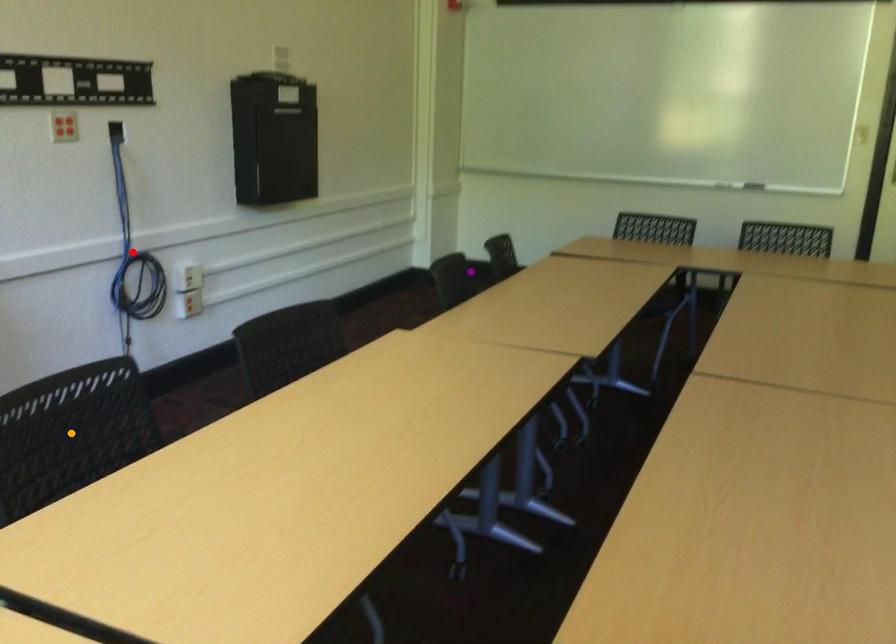
Order these from nearest to farthest:
- orange point
- purple point
- red point

orange point, red point, purple point